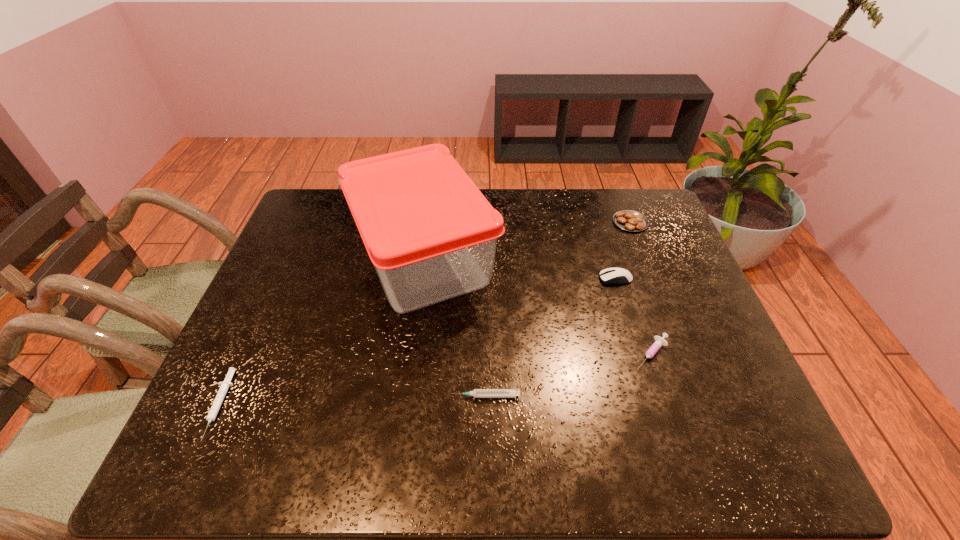
Identify the location of syringe at the right edge. (660, 341).

At what (x,y) coordinates should I click in order to perform the action: click on object at the near left corner. Please return your answer as a coordinate pair (x, y). The height and width of the screenshot is (540, 960). Looking at the image, I should click on (224, 386).

Identify the location of object present at the far right corner. The image size is (960, 540). (628, 220).

Find the location of `vacant space at the far edge of the desktop`. vacant space at the far edge of the desktop is located at coordinates pyautogui.click(x=506, y=200).

Identify the location of free space at the near edge. This screenshot has width=960, height=540. (502, 442).

The image size is (960, 540). In the image, there is a desktop. Find the location of `vacant space at the left edge`. vacant space at the left edge is located at coordinates (324, 252).

Where is `vacant region at the right edge`? The height and width of the screenshot is (540, 960). vacant region at the right edge is located at coordinates (717, 428).

This screenshot has width=960, height=540. I want to click on vacant space at the far left corner, so click(330, 206).

This screenshot has width=960, height=540. What are the coordinates of `vacant space that's between the mouse and the tray` in the screenshot? It's located at (519, 268).

The width and height of the screenshot is (960, 540). I want to click on free spot between the tray and the pastry, so pyautogui.click(x=526, y=240).